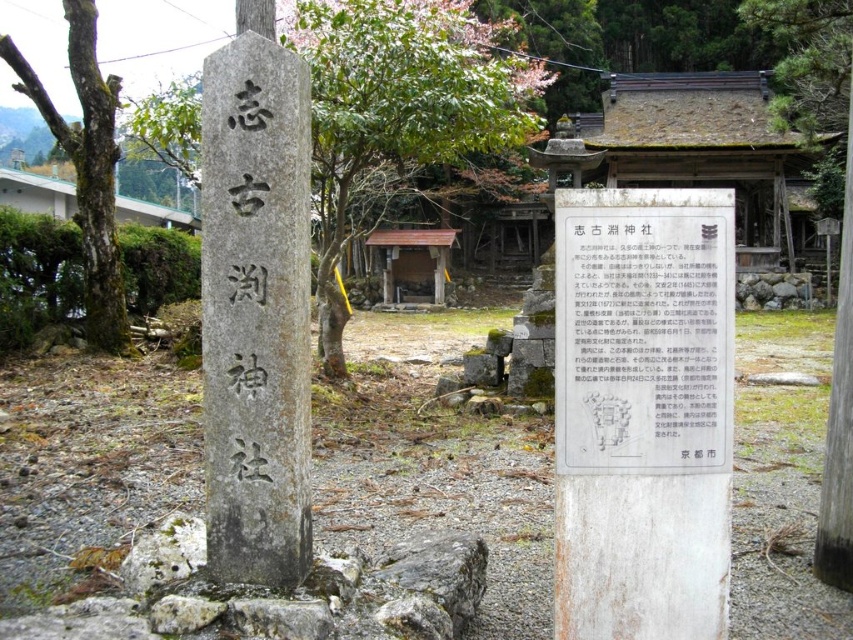
Based on the photo, who is more forward, [209,326] or [112,324]?

Point [209,326] is more forward.

Can you confirm if gray stone monument at center is positioned below smooth bark tree at left?

Correct, gray stone monument at center is located below smooth bark tree at left.

Who is more distant from viewer, [223,378] or [103,237]?

The point [103,237] is behind.

This screenshot has height=640, width=853. I want to click on gray stone monument at center, so click(x=254, y=312).

At what (x,y) coordinates should I click in order to perform the action: click on white paper sign at center. Please return your answer as a coordinate pair (x, y). The height and width of the screenshot is (640, 853). Looking at the image, I should click on (643, 344).

Looking at this image, how far apart are white paper sign at center and smooth bark tree at left?

The distance of white paper sign at center from smooth bark tree at left is 9.74 meters.

Is point (666, 452) farther from viewer compared to point (97, 220)?

No, (666, 452) is in front of (97, 220).

Locate an element on the screen. This screenshot has width=853, height=640. white paper sign at center is located at coordinates (643, 344).

Which is in front, point (247, 563) or point (675, 272)?

Point (675, 272) is in front.

Between point (225, 548) and point (625, 248), which one is positioned behind?

Point (225, 548)

The image size is (853, 640). What are the coordinates of `gray stone monument at center` in the screenshot? It's located at (254, 312).